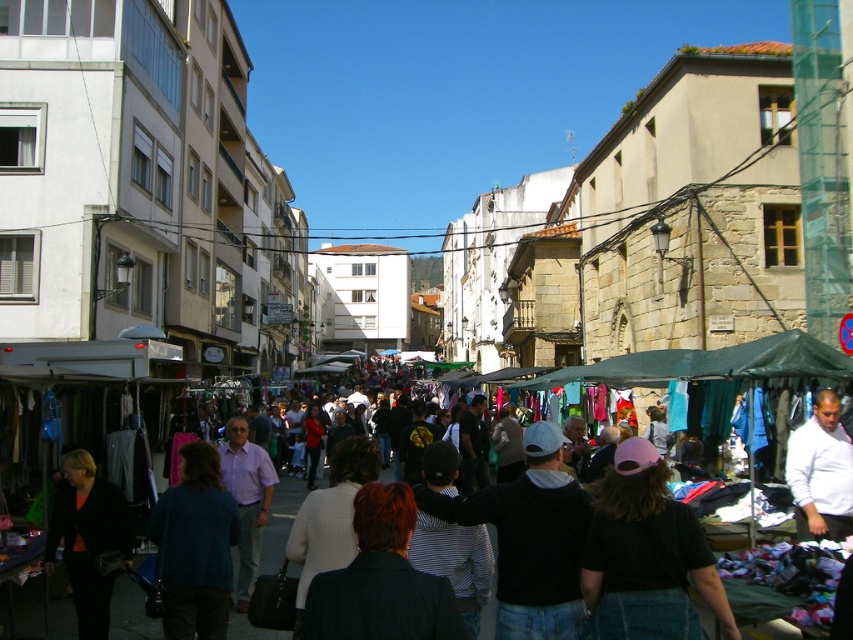
You are a shopper at the market and want to buy a jacket and a tent. You see the black leather jacket at lower left and the green fabric tent at center. Which item is closer to the left side of the market?

The black leather jacket at lower left is closer to the left side of the market because it is positioned to the left of the green fabric tent at center.